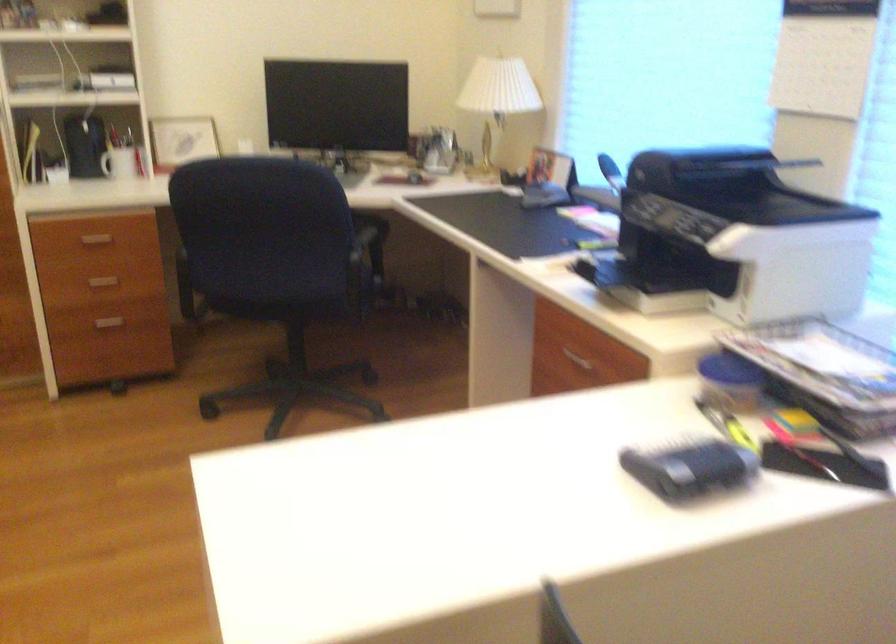
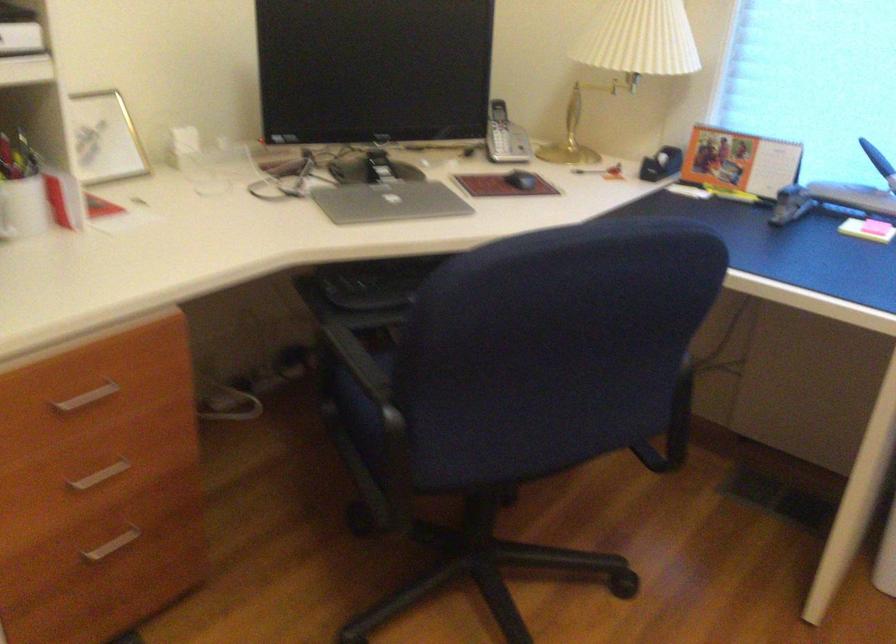
Find the pixel in the second image that matches pixel 101 287 in the first image.

(99, 475)